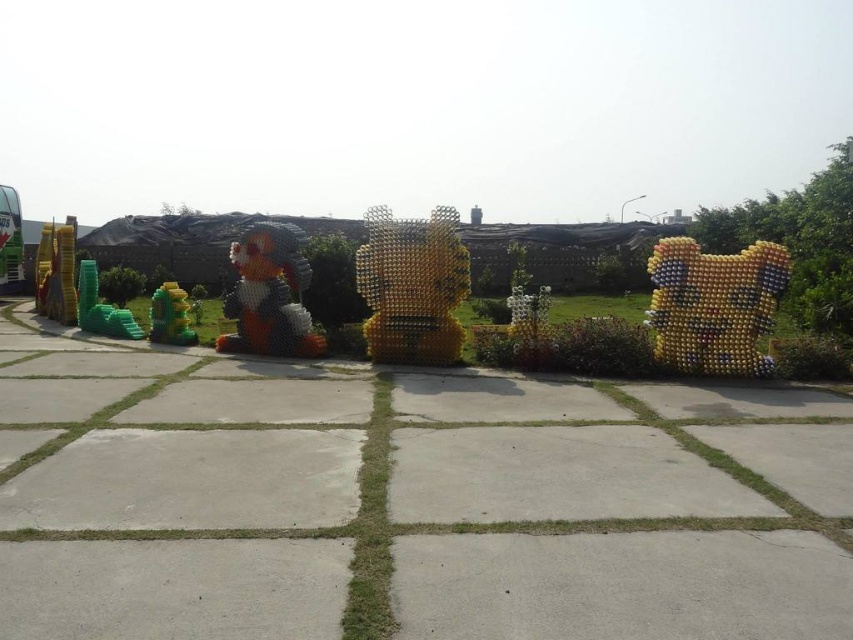
Which of these two, multicolored plastic bottle at right or yellow metallic sculpture at center, stands taller?

Standing taller between the two is yellow metallic sculpture at center.

Who is positioned more to the left, multicolored plastic bottle at right or yellow metallic sculpture at center?

From the viewer's perspective, yellow metallic sculpture at center appears more on the left side.

Is point (675, 320) in front of point (445, 212)?

That is True.

The image size is (853, 640). Identify the location of multicolored plastic bottle at right. pos(714,305).

Does multicolored plastic bottle at right appear under shiny green toy at lower left?

No.

Which is below, multicolored plastic bottle at right or shiny green toy at lower left?

shiny green toy at lower left is lower down.

The height and width of the screenshot is (640, 853). I want to click on multicolored plastic bottle at right, so click(x=714, y=305).

Can you confirm if multicolored plastic bottle at right is wider than multicolored plastic bottle at center?

In fact, multicolored plastic bottle at right might be narrower than multicolored plastic bottle at center.

What do you see at coordinates (714, 305) in the screenshot?
I see `multicolored plastic bottle at right` at bounding box center [714, 305].

Is point (763, 333) in front of point (288, 227)?

Yes.

Locate an element on the screen. The image size is (853, 640). multicolored plastic bottle at right is located at coordinates (714, 305).